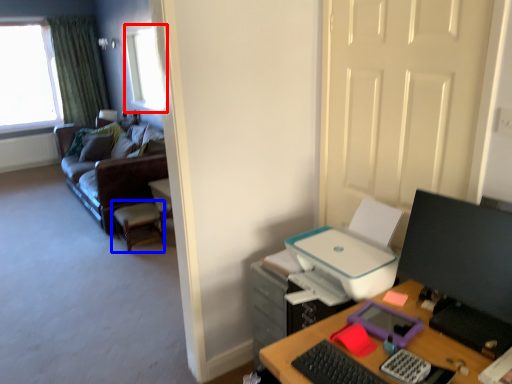
Question: Which of the following is the closest to the observer, window (highlighted by a red box) or computer chair (highlighted by a blue box)?

Choices:
 (A) window
 (B) computer chair

Answer: (B)